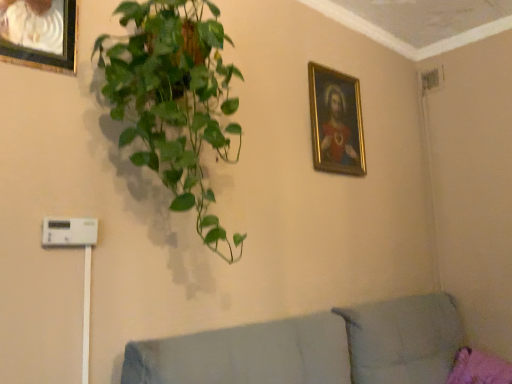
Question: Is light gray fabric couch at lower right taller or shorter than white plastic light switch at lower left?

Choices:
 (A) short
 (B) tall

Answer: (B)

Question: Is light gray fabric couch at lower right to the left or to the right of white plastic light switch at lower left in the image?

Choices:
 (A) left
 (B) right

Answer: (B)

Question: Which object is the farthest from the white plastic light switch at lower left?

Choices:
 (A) light gray fabric couch at lower right
 (B) gold-framed painting at upper right, acting as the second picture frame starting from the front
 (C) brushed metal picture frame at upper left, which appears as the first picture frame when viewed from the front
 (D) green glossy plant at upper left

Answer: (B)

Question: Which is nearer to the brushed metal picture frame at upper left, which appears as the first picture frame when viewed from the left?

Choices:
 (A) green glossy plant at upper left
 (B) light gray fabric couch at lower right
 (C) gold-framed painting at upper right, which is the 2th picture frame from left to right
 (D) white plastic light switch at lower left

Answer: (A)